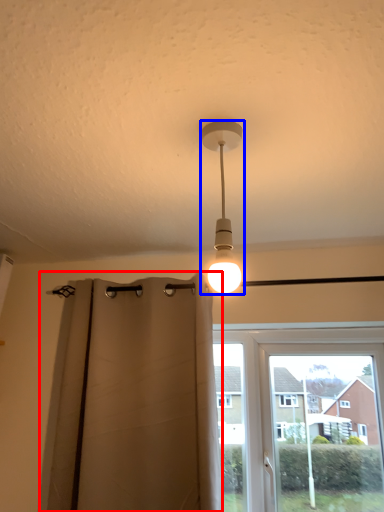
Question: Among these objects, which one is farthest to the camera, curtain (highlighted by a red box) or lamp (highlighted by a blue box)?

Choices:
 (A) curtain
 (B) lamp

Answer: (A)